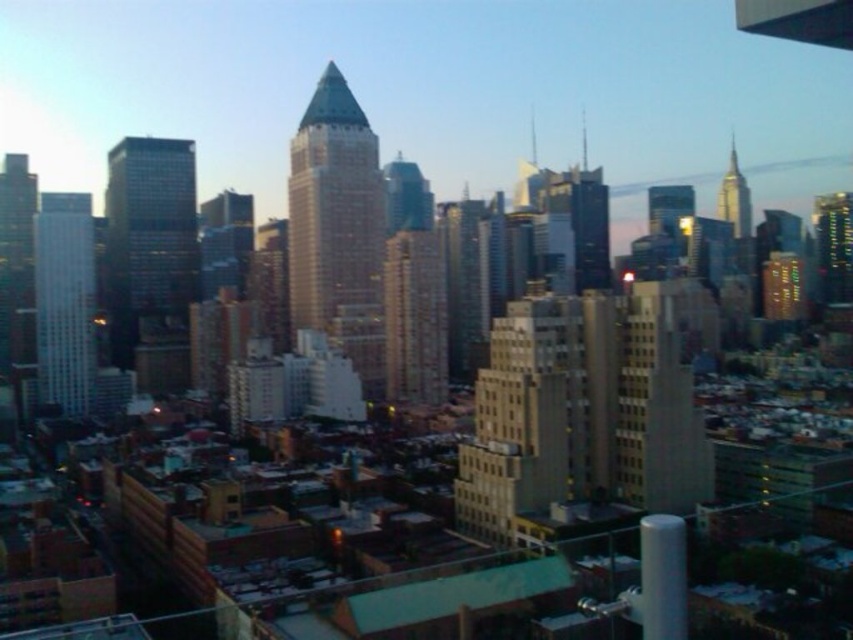
You are a city planner assessing the distance between two key landmarks in the cityscape. The smooth glass skyscraper at left and the gold reflective spire at upper right are both critical for urban planning. Given that the city requires a minimum distance of 300 meters between major landmarks for safety regulations, does the current spacing between these two structures meet the requirement?

The smooth glass skyscraper at left and gold reflective spire at upper right are 349.73 meters apart, which exceeds the 300 meter minimum requirement, so they meet the safety regulations.

You are a drone operator tasked with flying a drone from the sleek glass skyscraper at center to the gold reflective spire at upper right. Based on the cityscape scene, which direction should you steer the drone to reach the spire?

The sleek glass skyscraper at center is to the left of the gold reflective spire at upper right, so you should steer the drone to the right to reach the spire.